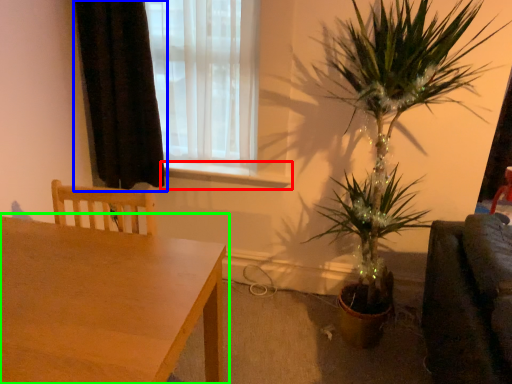
Question: Estimate the real-world distances between objects in this image. Which object is closer to window sill (highlighted by a red box), curtain (highlighted by a blue box) or table (highlighted by a green box)?

Choices:
 (A) curtain
 (B) table

Answer: (A)